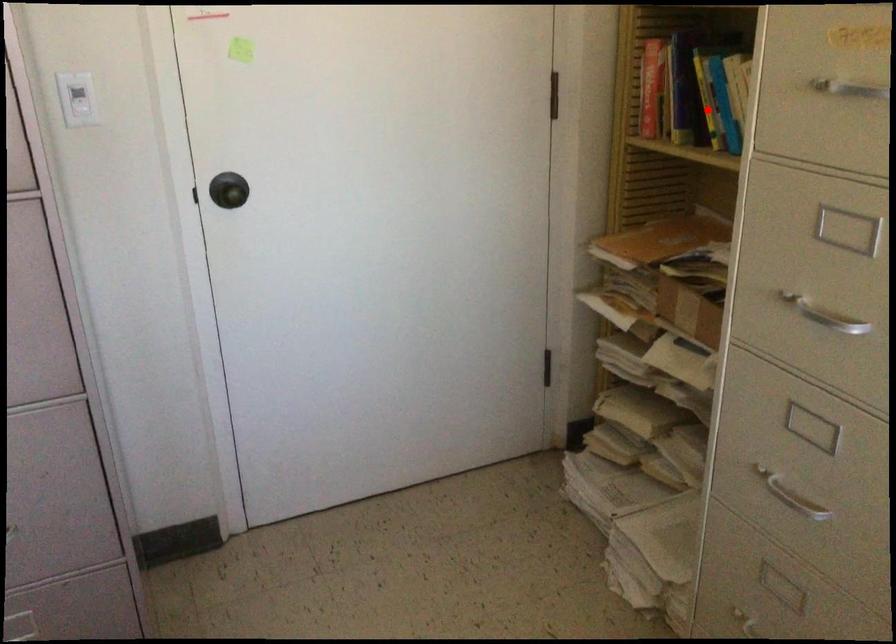
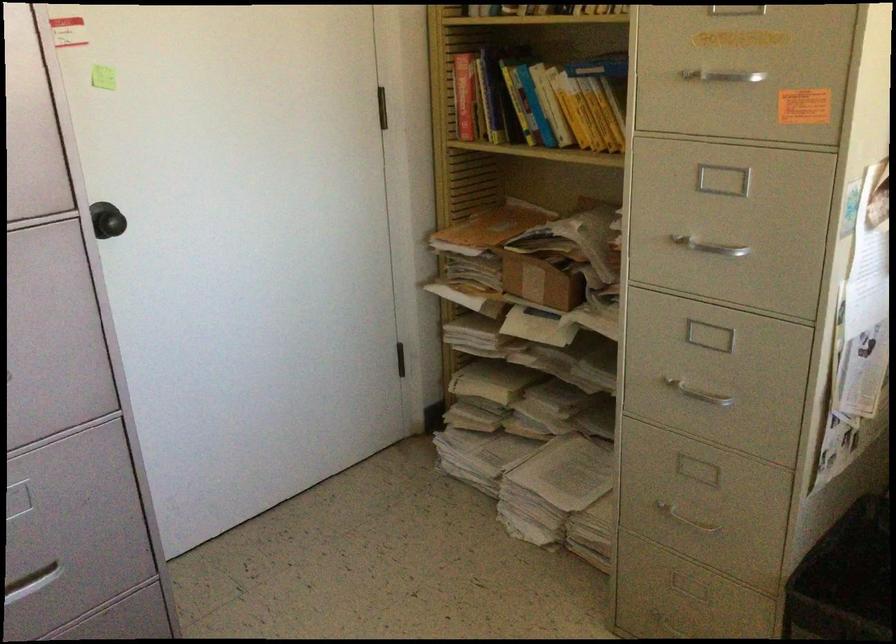
Question: I am providing you with two images of the same scene from different viewpoints. A red point is shown in image1. For the corresponding object point in image2, is it positioned nearer or farther from the camera?

Choices:
 (A) Nearer
 (B) Farther

Answer: (B)